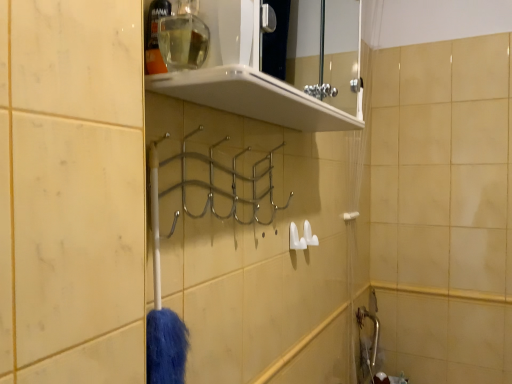
Question: Visually, is clear plastic bottle at upper center, the 2th toiletry in the right-to-left sequence, positioned to the left or to the right of white plastic towel bar at right?

Choices:
 (A) right
 (B) left

Answer: (B)

Question: Does point (148, 23) appear closer or farther from the camera than point (347, 218)?

Choices:
 (A) farther
 (B) closer

Answer: (B)

Question: Which object is the closest to the white plastic towel bar at right?

Choices:
 (A) clear plastic bottle at upper center, the first toiletry viewed from the left
 (B) translucent plastic shower curtain at right
 (C) clear glass bottle at upper center, marked as the second toiletry in a left-to-right arrangement
 (D) chrome metallic hanger at center
 (E) white glossy shelf at upper center

Answer: (B)

Question: Which object is the farthest from the chrome metallic hanger at center?

Choices:
 (A) translucent plastic shower curtain at right
 (B) white plastic towel bar at right
 (C) white glossy shelf at upper center
 (D) clear glass bottle at upper center, the first toiletry from the right
 (E) clear plastic bottle at upper center, the 2th toiletry in the right-to-left sequence

Answer: (C)